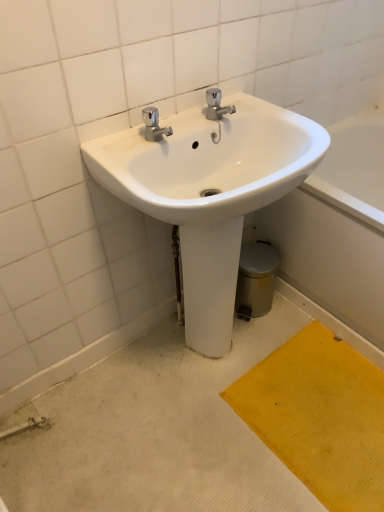
The height and width of the screenshot is (512, 384). What do you see at coordinates (210, 193) in the screenshot?
I see `white glossy sink at center` at bounding box center [210, 193].

Where is `white glossy sink at center`? white glossy sink at center is located at coordinates (210, 193).

Where is `white glossy bath at lower right`? This screenshot has width=384, height=512. white glossy bath at lower right is located at coordinates (338, 227).

This screenshot has width=384, height=512. Describe the element at coordinates (319, 416) in the screenshot. I see `yellow textured mat at lower right` at that location.

Locate an element on the screen. The width and height of the screenshot is (384, 512). white glossy sink at center is located at coordinates (210, 193).

From the image's perspective, would you say white glossy bath at lower right is positioned over yellow textured mat at lower right?

Correct, white glossy bath at lower right appears higher than yellow textured mat at lower right in the image.

In the scene shown: Which is further, (350, 307) or (303, 378)?

Point (350, 307)

How many degrees apart are the facing directions of white glossy bath at lower right and yellow textured mat at lower right?

The facing directions of white glossy bath at lower right and yellow textured mat at lower right are 0.153 degrees apart.

Are white glossy bath at lower right and yellow textured mat at lower right beside each other?

white glossy bath at lower right is not next to yellow textured mat at lower right, and they're not touching.

From the image's perspective, is white glossy bath at lower right under white glossy sink at center?

No.

You are a GUI agent. You are given a task and a screenshot of the screen. Output one action in this format:
    pyautogui.click(x=<x>, y=<y>)
    Task: Click on the bath on the right of white glossy sink at center
    This screenshot has width=384, height=512.
    Given the screenshot: What is the action you would take?
    pyautogui.click(x=338, y=227)

Considering the sizes of objects white glossy bath at lower right and white glossy sink at center in the image provided, who is thinner, white glossy bath at lower right or white glossy sink at center?

white glossy sink at center is thinner.

Can you confirm if yellow textured mat at lower right is taller than white glossy bath at lower right?

No, yellow textured mat at lower right is not taller than white glossy bath at lower right.

Between yellow textured mat at lower right and white glossy bath at lower right, which one has smaller size?

yellow textured mat at lower right is smaller.

Based on the photo, from a real-world perspective, relative to white glossy bath at lower right, is yellow textured mat at lower right vertically above or below?

yellow textured mat at lower right is situated lower than white glossy bath at lower right in the real world.

Between yellow textured mat at lower right and white glossy bath at lower right, which one has larger width?

Wider between the two is white glossy bath at lower right.

Is yellow textured mat at lower right positioned with its back to white glossy sink at center?

yellow textured mat at lower right does not have its back to white glossy sink at center.

Can white glossy sink at center be found inside yellow textured mat at lower right?

That's incorrect, white glossy sink at center is not inside yellow textured mat at lower right.

Is yellow textured mat at lower right behind white glossy sink at center?

Yes.

Is yellow textured mat at lower right directly adjacent to white glossy sink at center?

yellow textured mat at lower right and white glossy sink at center are not in contact.

From the image's perspective, which is below, white glossy sink at center or white glossy bath at lower right?

white glossy sink at center.

Is white glossy sink at center with white glossy bath at lower right?

No, white glossy sink at center is not beside white glossy bath at lower right.

Between white glossy sink at center and white glossy bath at lower right, which one is positioned in front?

white glossy sink at center is more forward.

From the picture: Is white glossy sink at center completely or partially outside of yellow textured mat at lower right?

That's correct, white glossy sink at center is outside of yellow textured mat at lower right.

From the image's perspective, which one is positioned lower, white glossy sink at center or yellow textured mat at lower right?

yellow textured mat at lower right.

Where is `sink above the yellow textured mat at lower right (from a real-world perspective)`? This screenshot has height=512, width=384. sink above the yellow textured mat at lower right (from a real-world perspective) is located at coordinates point(210,193).

Considering the relative sizes of white glossy sink at center and yellow textured mat at lower right in the image provided, is white glossy sink at center taller than yellow textured mat at lower right?

Answer: Yes.

Image resolution: width=384 pixels, height=512 pixels. What are the coordinates of `doormat that appears below the white glossy bath at lower right (from a real-world perspective)` in the screenshot? It's located at (319, 416).

I want to click on bath that is behind the white glossy sink at center, so click(x=338, y=227).

When comparing their distances from white glossy bath at lower right, does yellow textured mat at lower right or white glossy sink at center seem further?

The object further to white glossy bath at lower right is white glossy sink at center.

Based on their spatial positions, is white glossy sink at center or yellow textured mat at lower right further from white glossy bath at lower right?

white glossy sink at center is further to white glossy bath at lower right.

Considering their positions, is white glossy bath at lower right positioned further to yellow textured mat at lower right than white glossy sink at center?

Based on the image, white glossy sink at center appears to be further to yellow textured mat at lower right.

Looking at the image, which one is located closer to yellow textured mat at lower right, white glossy sink at center or white glossy bath at lower right?

white glossy bath at lower right is positioned closer to the anchor yellow textured mat at lower right.

Considering their positions, is white glossy bath at lower right positioned closer to white glossy sink at center than yellow textured mat at lower right?

Among the two, white glossy bath at lower right is located nearer to white glossy sink at center.

Estimate the real-world distances between objects in this image. Which object is closer to white glossy sink at center, yellow textured mat at lower right or white glossy bath at lower right?

white glossy bath at lower right.

Where is `doormat between white glossy sink at center and white glossy bath at lower right`? The height and width of the screenshot is (512, 384). doormat between white glossy sink at center and white glossy bath at lower right is located at coordinates (319, 416).